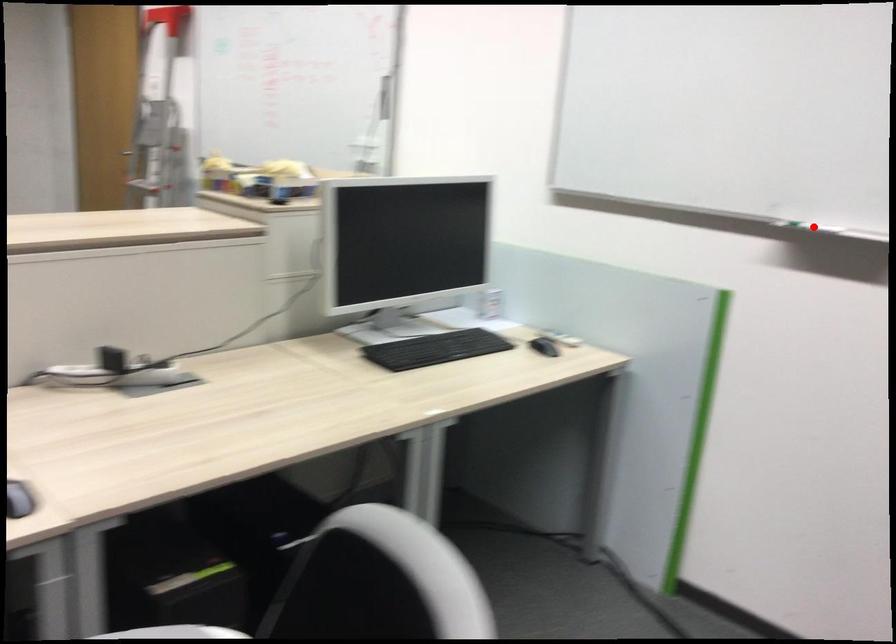
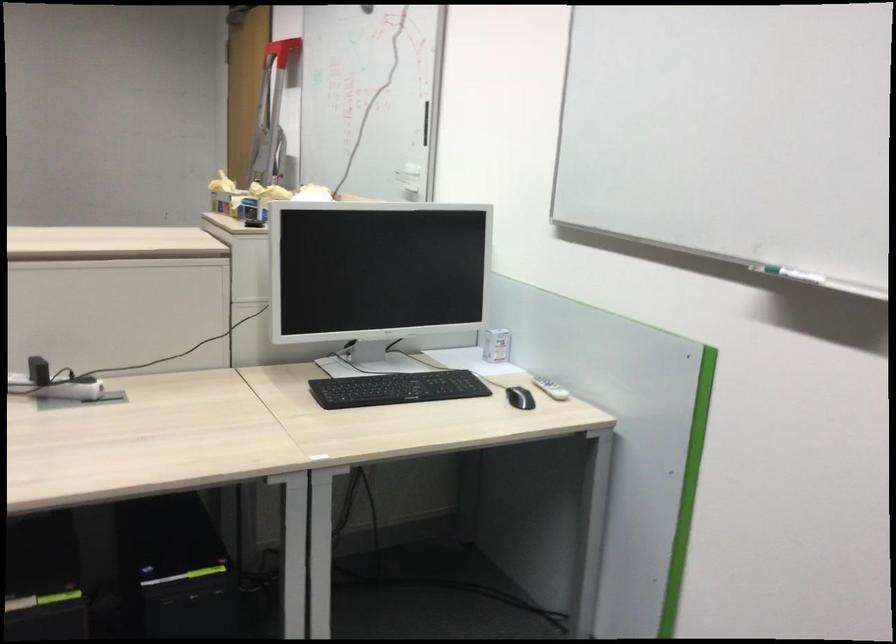
Question: I am providing you with two images of the same scene from different viewpoints. In image1, a red point is highlighted. Considering the same 3D point in image2, which of the following is correct?

Choices:
 (A) It is closer
 (B) It is farther

Answer: (A)